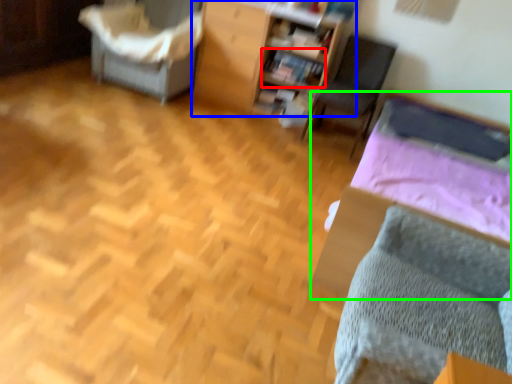
Question: Estimate the real-world distances between objects in this image. Which object is farther from book (highlighted by a red box), furniture (highlighted by a blue box) or bed (highlighted by a green box)?

Choices:
 (A) furniture
 (B) bed

Answer: (B)